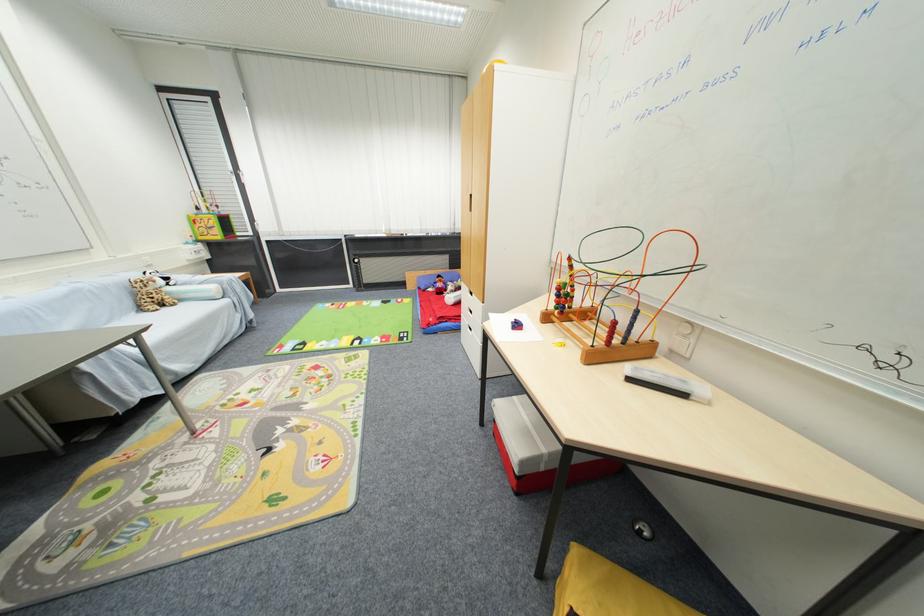
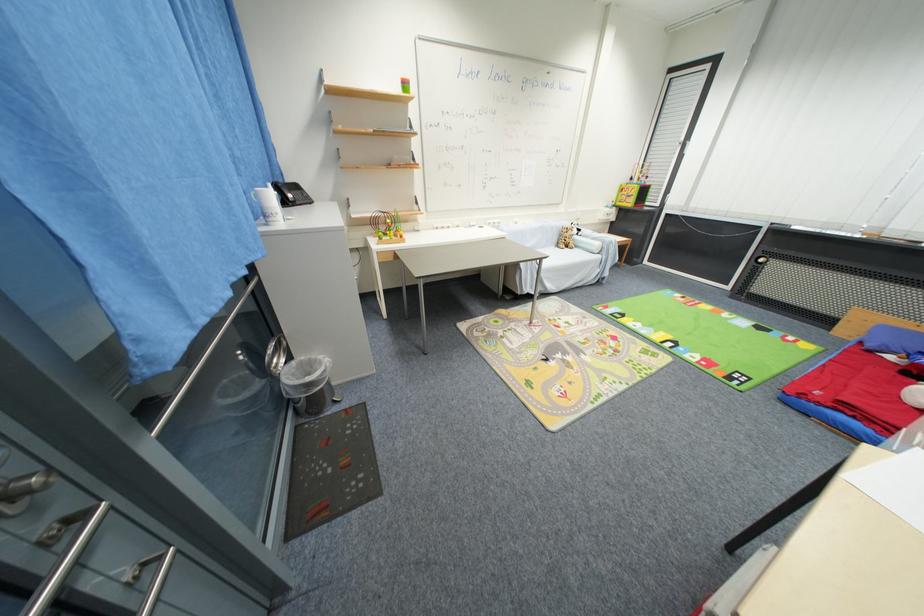
Locate, in the second image, the point that corresponds to pixel 441 326 in the first image.

(824, 406)